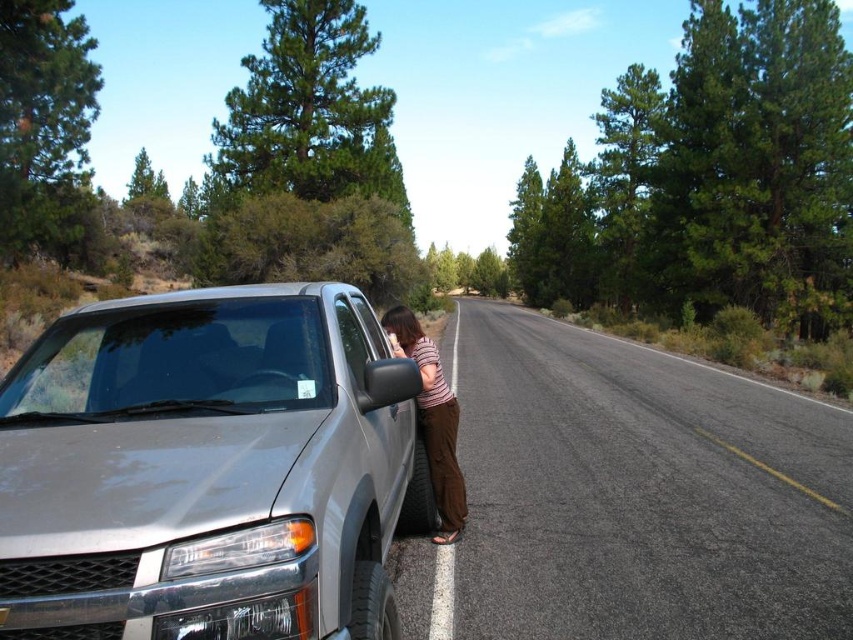
Is point (430, 429) positioned behind point (399, 326)?

That is False.

Find the location of a particular element. The height and width of the screenshot is (640, 853). striped fabric shirt at center is located at coordinates (432, 420).

Does point (439, 456) come farther from viewer compared to point (398, 328)?

No, (439, 456) is closer to viewer.

In order to click on striped fabric shirt at center in this screenshot , I will do `click(432, 420)`.

Between transparent glass windshield at center and striped fabric shirt at center, which one has more height?

transparent glass windshield at center

Who is more forward, (155,401) or (427,340)?

Point (155,401) is in front.

Where is `transparent glass windshield at center`? The width and height of the screenshot is (853, 640). transparent glass windshield at center is located at coordinates pos(173,360).

Which of these two, transparent glass windshield at center or matte brown hair at side, stands taller?

transparent glass windshield at center is taller.

Which of these two, transparent glass windshield at center or matte brown hair at side, stands shorter?

matte brown hair at side

Is point (323, 371) positioned after point (402, 323)?

No, (323, 371) is closer to viewer.

Where is `transparent glass windshield at center`? transparent glass windshield at center is located at coordinates (173, 360).